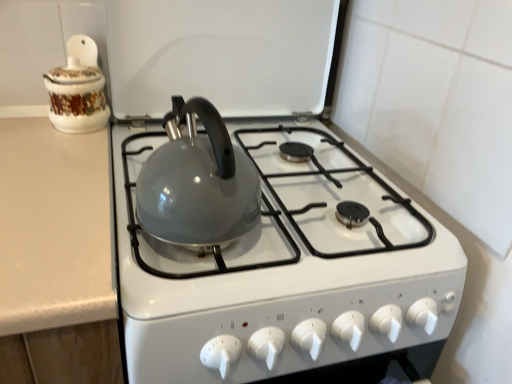
Question: From a real-world perspective, is porcelain floral jar at upper left physically located above or below glossy ceramic kettle at center?

Choices:
 (A) above
 (B) below

Answer: (A)

Question: Is porcelain floral jar at upper left wider or thinner than glossy ceramic kettle at center?

Choices:
 (A) wide
 (B) thin

Answer: (B)

Question: Relative to glossy ceramic kettle at center, is porcelain floral jar at upper left in front or behind?

Choices:
 (A) front
 (B) behind

Answer: (B)

Question: From their relative heights in the image, would you say glossy ceramic kettle at center is taller or shorter than porcelain floral jar at upper left?

Choices:
 (A) tall
 (B) short

Answer: (A)

Question: From a real-world perspective, relative to porcelain floral jar at upper left, is glossy ceramic kettle at center vertically above or below?

Choices:
 (A) above
 (B) below

Answer: (B)

Question: Is glossy ceramic kettle at center wider or thinner than porcelain floral jar at upper left?

Choices:
 (A) thin
 (B) wide

Answer: (B)

Question: Relative to porcelain floral jar at upper left, is glossy ceramic kettle at center in front or behind?

Choices:
 (A) front
 (B) behind

Answer: (A)